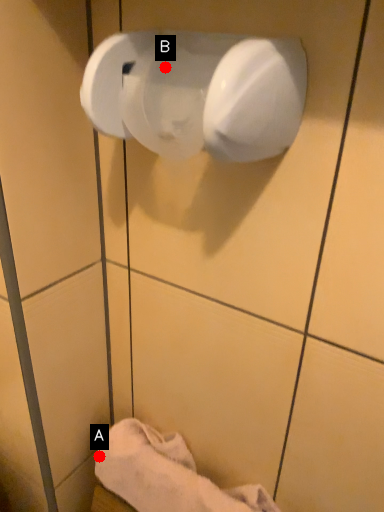
Question: Two points are circled on the image, labeled by A and B beside each circle. Which of the following is the closest to the observer?

Choices:
 (A) A is closer
 (B) B is closer

Answer: (B)